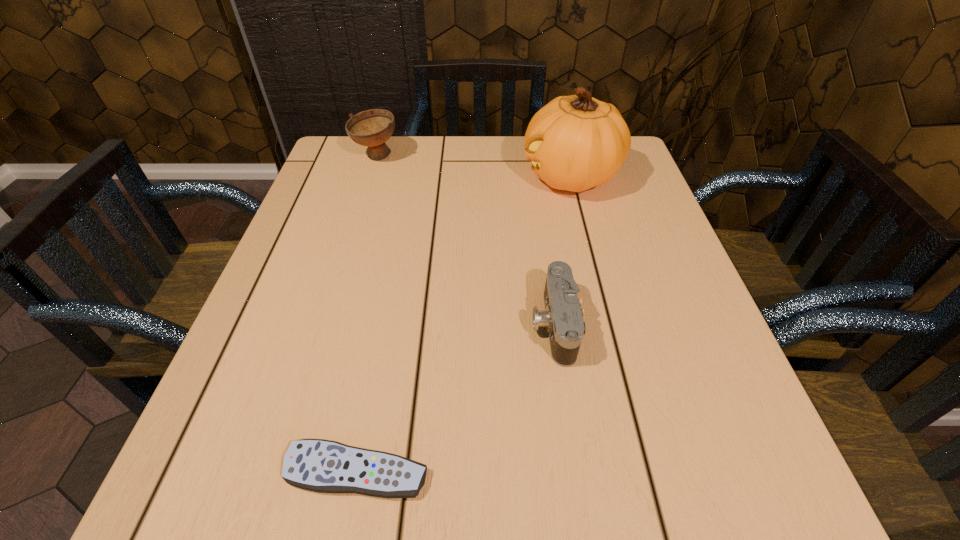
Identify the location of free area in between the pumpkin and the remote control. (464, 324).

Identify which object is the closest to the soup bowl. Please provide its 2D coordinates. Your answer should be formatted as a tuple, i.e. [(x, y)], where the tuple contains the x and y coordinates of a point satisfying the conditions above.

[(576, 142)]

Image resolution: width=960 pixels, height=540 pixels. I want to click on object that is the closest to the third tallest object, so click(318, 465).

Where is `vacant region that satisfies the following two spatial constraints: 1. on the front face of the tallest object; 2. on the front side of the nearest object`? Image resolution: width=960 pixels, height=540 pixels. vacant region that satisfies the following two spatial constraints: 1. on the front face of the tallest object; 2. on the front side of the nearest object is located at coordinates (645, 471).

This screenshot has width=960, height=540. I want to click on free point that satisfies the following two spatial constraints: 1. on the front face of the tallest object; 2. on the front side of the remote control, so click(x=645, y=471).